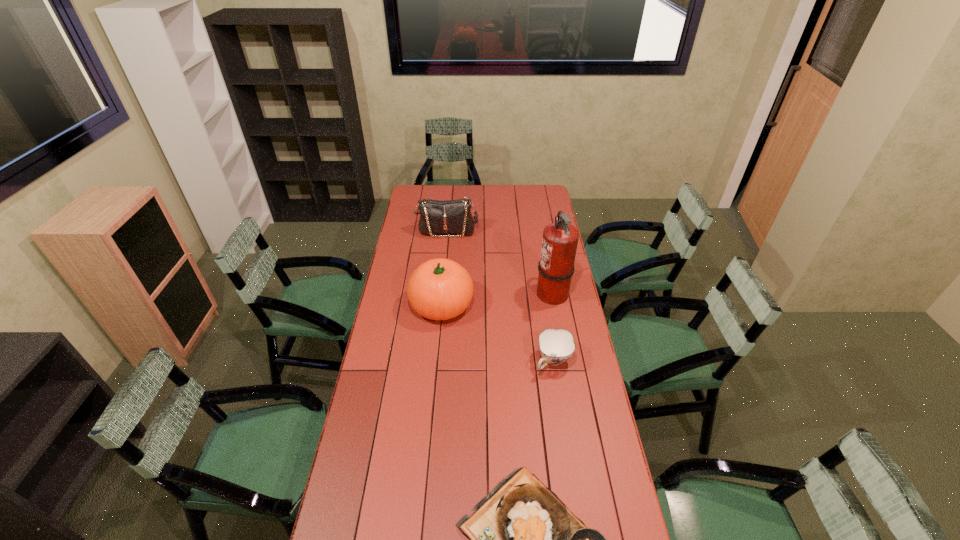
Image resolution: width=960 pixels, height=540 pixels. I want to click on unoccupied position between the fire extinguisher and the handbag, so click(499, 262).

Locate an element on the screen. Image resolution: width=960 pixels, height=540 pixels. vacant point located between the handbag and the chinaware is located at coordinates (500, 296).

You are a GUI agent. You are given a task and a screenshot of the screen. Output one action in this format:
    pyautogui.click(x=<x>, y=<y>)
    Task: Click on the blank region between the chinaware and the handbag
    This screenshot has height=540, width=960.
    Given the screenshot: What is the action you would take?
    pyautogui.click(x=500, y=296)

Identify the location of object that is the fourth closest to the shortest object. (450, 216).

Locate an element on the screen. object that is the fourth nearest to the platter is located at coordinates (450, 216).

This screenshot has height=540, width=960. In order to click on vacant point that satisfies the following two spatial constraints: 1. at the front of the third shortest object with chain and zipper; 2. on the left side of the fourth farthest object in this screenshot , I will do `click(434, 361)`.